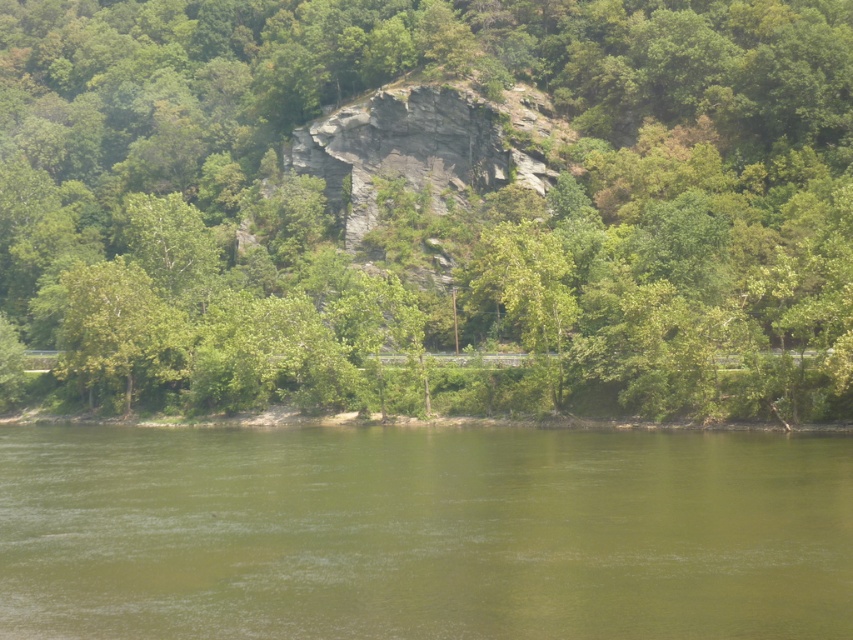
Question: Does green leafy tree at center have a larger size compared to green water at lower center?

Choices:
 (A) yes
 (B) no

Answer: (A)

Question: Which of the following is the closest to the observer?

Choices:
 (A) (583, 573)
 (B) (558, 358)

Answer: (A)

Question: Is green leafy tree at center wider than green water at lower center?

Choices:
 (A) yes
 (B) no

Answer: (A)

Question: Among these points, which one is farthest from the camera?

Choices:
 (A) (448, 164)
 (B) (494, 579)

Answer: (A)

Question: Can you confirm if green leafy tree at center is positioned above green water at lower center?

Choices:
 (A) no
 (B) yes

Answer: (B)